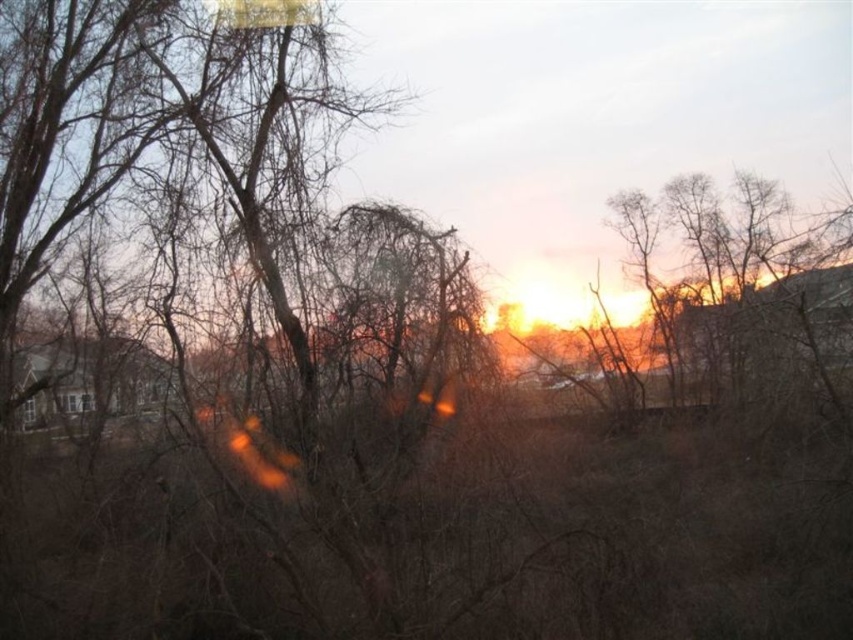
You are standing outside the house and looking at the clear glass window at lower left and transparent glass window at lower left. Which window would allow more light into the room? Please explain your reasoning based on their sizes.

The clear glass window at lower left is larger in size than the transparent glass window at lower left, so it would allow more light into the room because larger windows generally permit more light transmission.

You are standing in the winter scene and notice two points in the sky. The first point is at coordinates point (71, 404) and the second is at point (32, 412). Which point is closer to you?

Point (71, 404) is closer to the camera than point (32, 412).

You are standing outside the house in the residential area shown in the image. You notice a point at coordinates point (77, 403). Can you determine if this point is located on the clear glass window at lower left or somewhere else?

The point (77, 403) is on clear glass window at lower left.